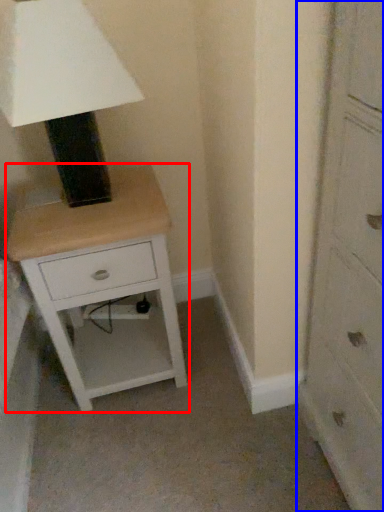
Question: Which of the following is the farthest to the observer, nightstand (highlighted by a red box) or chest of drawers (highlighted by a blue box)?

Choices:
 (A) nightstand
 (B) chest of drawers

Answer: (A)